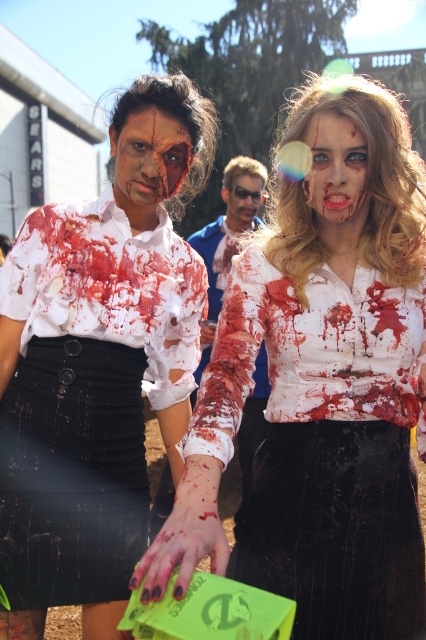
You are a photographer at the zombie event. You want to take a photo of the matte white face at center and the matte plastic sunglasses at center so that they are both in focus. Given that your camera can only keep objects within 2 meters in focus, will both objects be in focus?

The matte white face at center and matte plastic sunglasses at center are 2.90 meters apart. Since the distance between them exceeds the camera focus range of 2 meters, they cannot both be in focus at the same time.